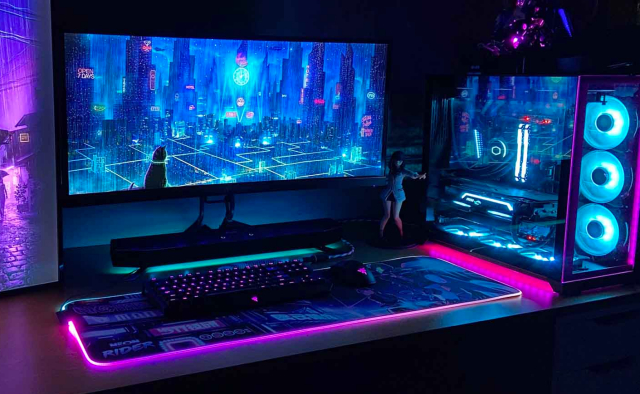
Identify the location of edge of desk. (465, 327).